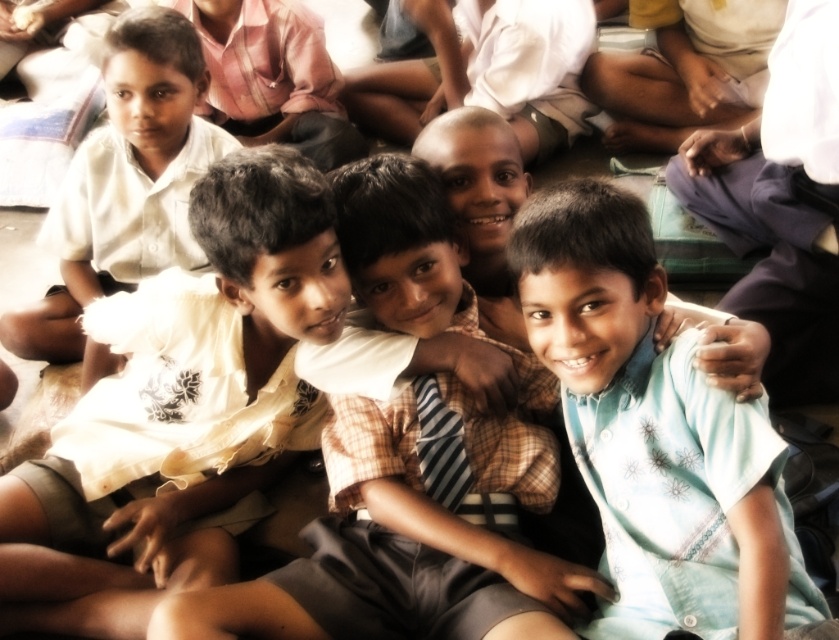
Question: Which of the following is the closest to the observer?

Choices:
 (A) light blue cotton shirt at center
 (B) white shirt at left
 (C) striped fabric tie at center
 (D) light blue shirt at center

Answer: (A)

Question: Is light blue cotton shirt at center thinner than striped fabric tie at center?

Choices:
 (A) yes
 (B) no

Answer: (B)

Question: Can you confirm if light blue cotton shirt at center is positioned to the left of light blue shirt at center?

Choices:
 (A) yes
 (B) no

Answer: (B)

Question: Considering the real-world distances, which object is farthest from the light blue cotton shirt at center?

Choices:
 (A) striped fabric tie at center
 (B) white shirt at left
 (C) light blue shirt at center

Answer: (B)

Question: Is light blue shirt at center thinner than white shirt at left?

Choices:
 (A) yes
 (B) no

Answer: (B)

Question: Estimate the real-world distances between objects in this image. Which object is farther from the striped fabric tie at center?

Choices:
 (A) light blue shirt at center
 (B) light blue cotton shirt at center

Answer: (B)